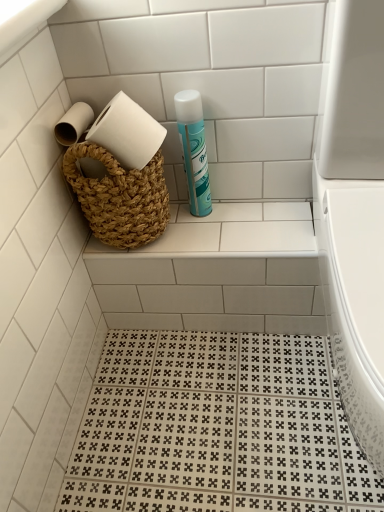
At what (x,y) coordinates should I click in order to perform the action: click on free space in front of teal matte cleaning product at upper center. Please return your answer as a coordinate pair (x, y). This screenshot has height=512, width=384. Looking at the image, I should click on (218, 236).